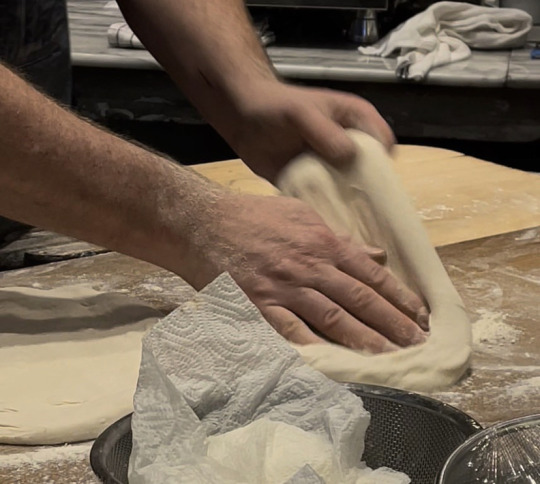
You are a GUI agent. You are given a task and a screenshot of the screen. Output one action in this format:
    pyautogui.click(x=<x>, y=<y>)
    Task: Click on the metal coutnertop
    
    Given the screenshot: What is the action you would take?
    pyautogui.click(x=346, y=73)